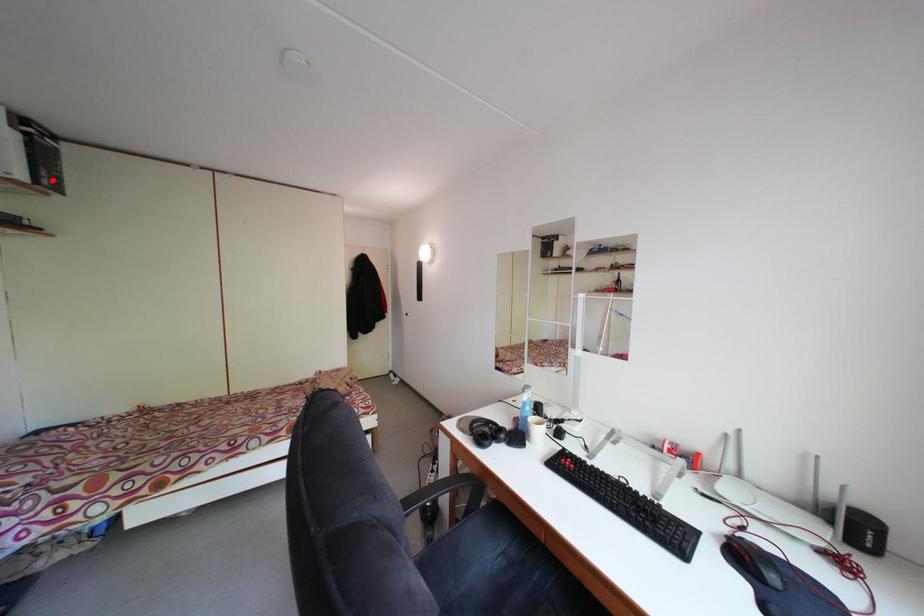
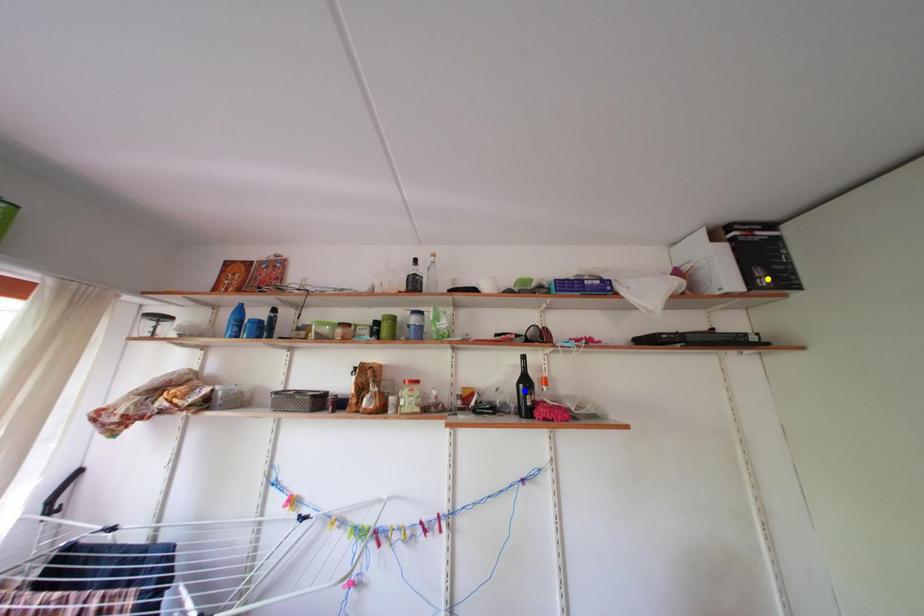
Question: I am providing you with two images of the same scene from different viewpoints. A red point is marked on the first image. You are given multiple points on the second image. Which spot in image 2 lines up with the point in image 1?

Choices:
 (A) green point
 (B) blue point
 (C) yellow point

Answer: (C)